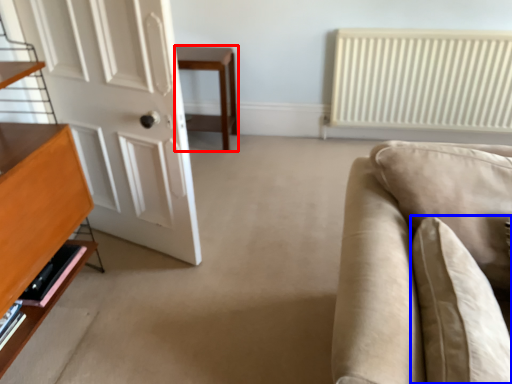
Question: Which object appears closest to the camera in this image, table (highlighted by a red box) or pillow (highlighted by a blue box)?

Choices:
 (A) table
 (B) pillow

Answer: (B)